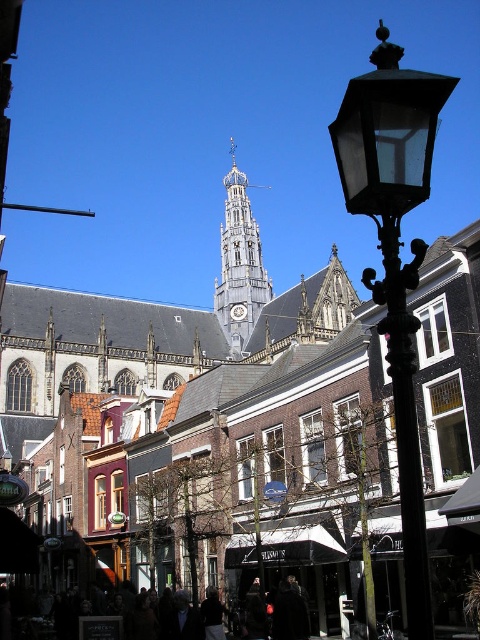
You are a tourist standing at the base of the Gothic church tower. You notice two items in the scene described in the image. One is dark clothing at lower center and the other is metallic clock at center. Which of these two items is taller?

The dark clothing at lower center is much taller than the metallic clock at center.

You are a tourist standing at the base of the Gothic church tower and want to take a photo of the point at coordinates point (396,408) and point (249,230). Which point should you focus on first to ensure both are in the frame?

You should focus on point (396,408) first because it is closer to you than point (249,230), so it will be in the foreground of your photo.

You are a tourist standing in the middle of the street looking towards the church tower. You see the matte black street lamp at right and the wooden spire at center. Which object is positioned further to the east?

The wooden spire at center is positioned further to the east because the matte black street lamp at right is to the right of it, meaning the spire is to the left relative to the tourist, which would be east if facing north.